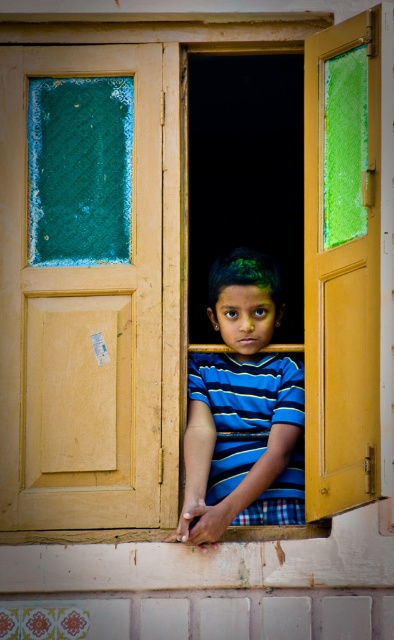
Describe the element at coordinates (79, 285) in the screenshot. The width and height of the screenshot is (394, 640). I see `wooden door at center` at that location.

Can you confirm if wooden door at center is wider than yellow matte door at right?

Correct, the width of wooden door at center exceeds that of yellow matte door at right.

Who is more distant from viewer, (x=76, y=92) or (x=312, y=236)?

The point (x=76, y=92) is behind.

Locate an element on the screen. Image resolution: width=394 pixels, height=640 pixels. wooden door at center is located at coordinates (79, 285).

Does wooden door at center have a lesser height compared to blue striped shirt at center?

No.

Where is `wooden door at center`? This screenshot has height=640, width=394. wooden door at center is located at coordinates (79, 285).

From the picture: Can you confirm if wooden door at center is bigger than wooden textured window sill at lower center?

Yes.

Is point (78, 445) less distant than point (102, 532)?

No, it is not.

The height and width of the screenshot is (640, 394). Find the location of `wooden door at center`. wooden door at center is located at coordinates (79, 285).